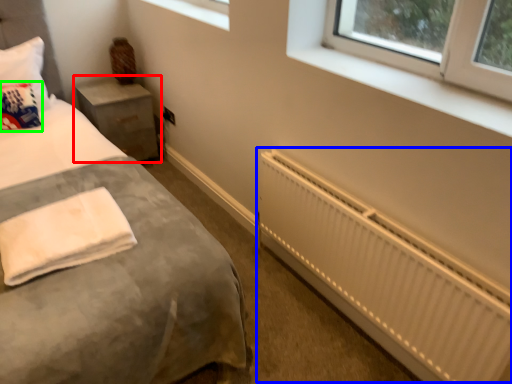
Question: Considering the real-world distances, which object is closest to nightstand (highlighted by a red box)? radiator (highlighted by a blue box) or throw pillow (highlighted by a green box).

Choices:
 (A) radiator
 (B) throw pillow

Answer: (B)